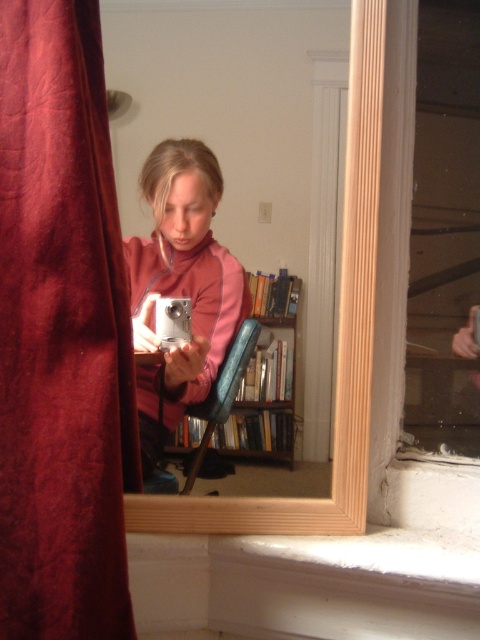
Consider the image. You are a photographer setting up a shot in the room. You have to decide whether to place a small decorative item on the wooden mirror at center or the matte pink sweater at center. Based on their sizes, which surface can better accommodate the item?

The wooden mirror at center is larger in size than the matte pink sweater at center, so the wooden mirror at center can better accommodate the small decorative item.

You are standing in the room and want to see the velvet red curtain at left in the reflection of the wooden mirror at center. Is it possible?

The velvet red curtain at left is in front of the wooden mirror at center, so it will block the mirror and its reflection. Therefore, you cannot see the velvet red curtain at left in the wooden mirror at center.

You are a photographer setting up a shoot in the room. You want to position a light source so it illuminates the wooden mirror at center without casting shadows from the velvet red curtain at left. Based on their positions, is this possible?

The velvet red curtain at left is located below the wooden mirror at center, so placing the light source above the wooden mirror at center would illuminate it while keeping the curtain below out of the light path, avoiding shadows.